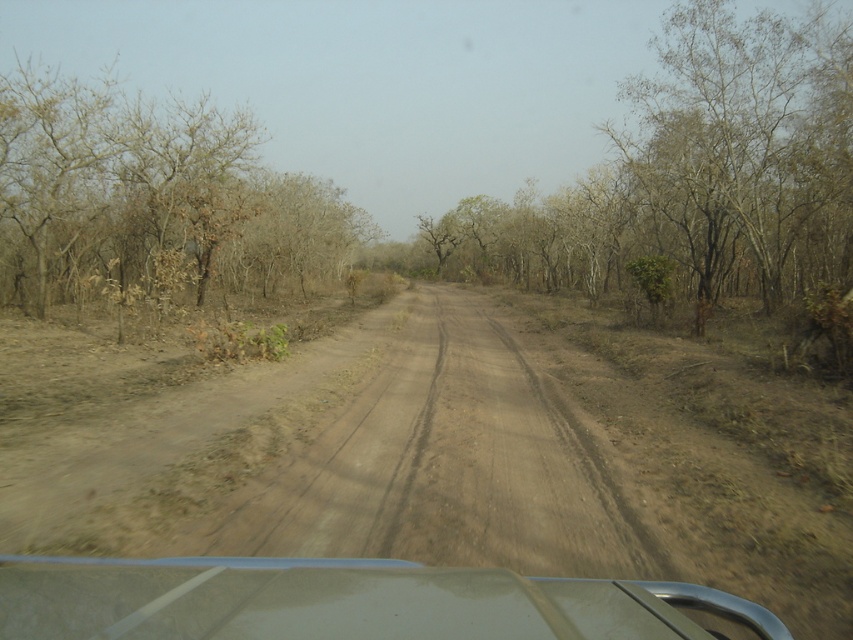
Question: Is bare branches at center further to camera compared to brown dirt track at center?

Choices:
 (A) yes
 (B) no

Answer: (A)

Question: Is brown dirt track at center below brown dry tree at left?

Choices:
 (A) yes
 (B) no

Answer: (A)

Question: Which point is farther from the camera taking this photo?

Choices:
 (A) (410, 493)
 (B) (666, 68)
 (C) (405, 573)
 (D) (152, 125)

Answer: (B)

Question: Which object appears farthest from the camera in this image?

Choices:
 (A) brown dry tree at left
 (B) bare branches at center
 (C) transparent plastic car window at center
 (D) brown dirt track at center

Answer: (B)

Question: Can you confirm if bare branches at center is positioned to the right of brown dry tree at left?

Choices:
 (A) yes
 (B) no

Answer: (A)

Question: Based on their relative distances, which object is nearer to the brown dirt track at center?

Choices:
 (A) brown dry tree at left
 (B) bare branches at center
 (C) transparent plastic car window at center

Answer: (C)